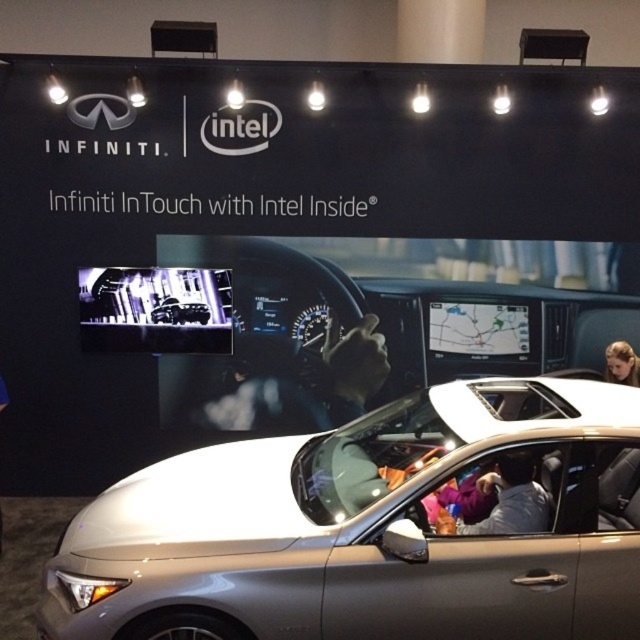
You are standing in front of the promotional display and want to know the distance between the satin silver car at center and the gray fabric jacket at center. Can you estimate how far apart they are?

The satin silver car at center is 41.46 centimeters from gray fabric jacket at center.

You are a customer looking at the promotional display for Infiniti and Intel. You notice a gray fabric jacket at center and a blonde hair at upper right. Which object is located lower in the image?

The gray fabric jacket at center is positioned under blonde hair at upper right, so it is located lower in the image.